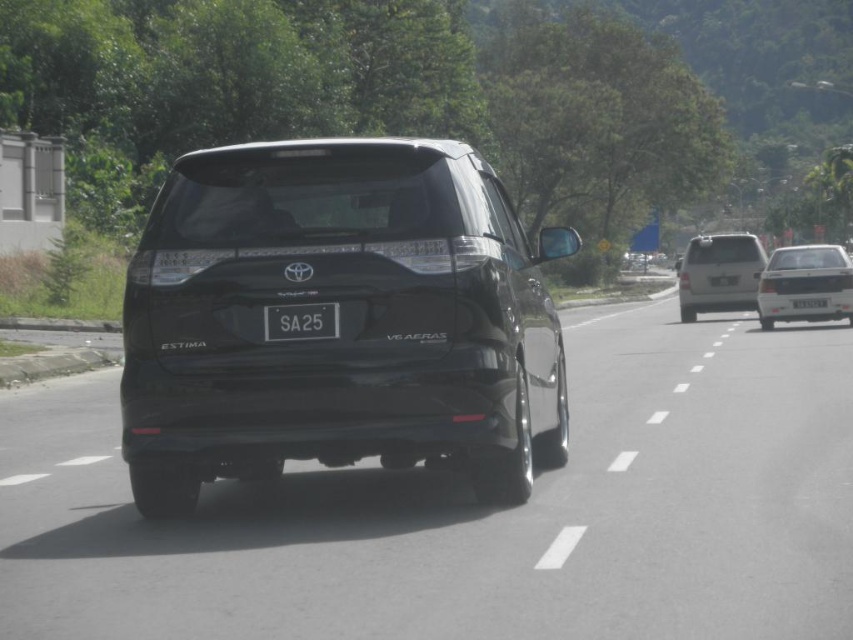
This screenshot has width=853, height=640. What do you see at coordinates (300, 321) in the screenshot?
I see `black plastic license plate at center` at bounding box center [300, 321].

Can you confirm if black plastic license plate at center is smaller than white plastic license plate at center?

Indeed, black plastic license plate at center has a smaller size compared to white plastic license plate at center.

Who is more forward, (335, 337) or (804, 298)?

Point (335, 337) is in front.

Where is `black plastic license plate at center`? black plastic license plate at center is located at coordinates (300, 321).

Does matte silver minivan at center have a lesser width compared to white plastic license plate at center?

No.

Is matte silver minivan at center shorter than white plastic license plate at center?

No, matte silver minivan at center is not shorter than white plastic license plate at center.

Which is in front, point (708, 268) or point (804, 300)?

Positioned in front is point (804, 300).

In order to click on matte silver minivan at center in this screenshot , I will do `click(718, 273)`.

Consider the image. Which is below, glossy black car at center or white glossy sedan at right?

glossy black car at center is below.

The height and width of the screenshot is (640, 853). I want to click on glossy black car at center, so click(x=474, y=513).